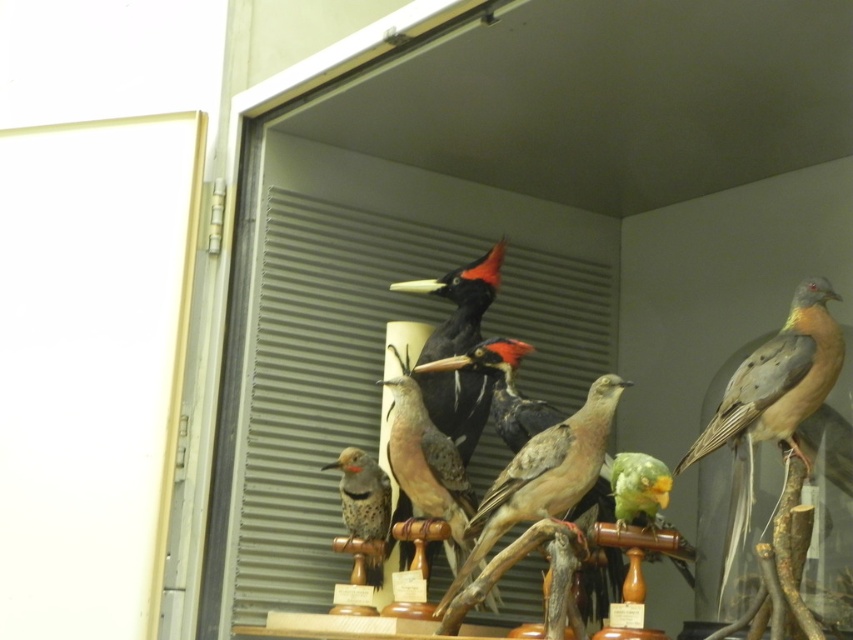
Can you confirm if matte brown woodpecker at center is positioned to the left of green matte parrot at center?

Yes, matte brown woodpecker at center is to the left of green matte parrot at center.

Who is positioned more to the left, matte brown woodpecker at center or green matte parrot at center?

matte brown woodpecker at center is more to the left.

Is point (367, 536) more distant than point (631, 472)?

Yes, point (367, 536) is behind point (631, 472).

Find the location of a particular element. matte brown woodpecker at center is located at coordinates (363, 493).

Is brown speckled feathers at center thinner than green matte parrot at center?

No, brown speckled feathers at center is not thinner than green matte parrot at center.

Can you confirm if brown speckled feathers at center is positioned above green matte parrot at center?

No, brown speckled feathers at center is not above green matte parrot at center.

Is point (480, 532) less distant than point (654, 461)?

No.

At what (x,y) coordinates should I click in order to perform the action: click on brown speckled feathers at center. Please return your answer as a coordinate pair (x, y). Image resolution: width=853 pixels, height=640 pixels. Looking at the image, I should click on (543, 477).

Is point (442, 282) positioned in front of point (637, 476)?

No, (442, 282) is behind (637, 476).

Measure the distance between point (x=422, y=346) and camera.

The distance of point (x=422, y=346) from camera is 2.20 meters.

Locate an element on the screen. black matte woodpecker at center is located at coordinates (459, 301).

This screenshot has width=853, height=640. I want to click on black matte woodpecker at center, so click(459, 301).